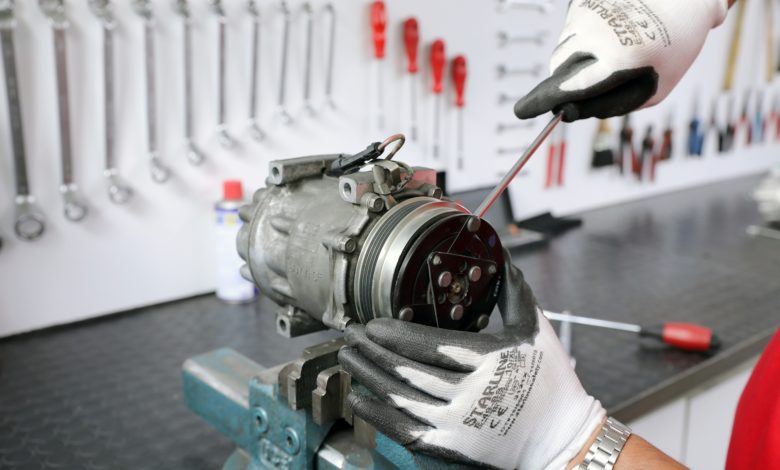
Image resolution: width=780 pixels, height=470 pixels. Find the location of `black and gray counter top`. black and gray counter top is located at coordinates (689, 268).